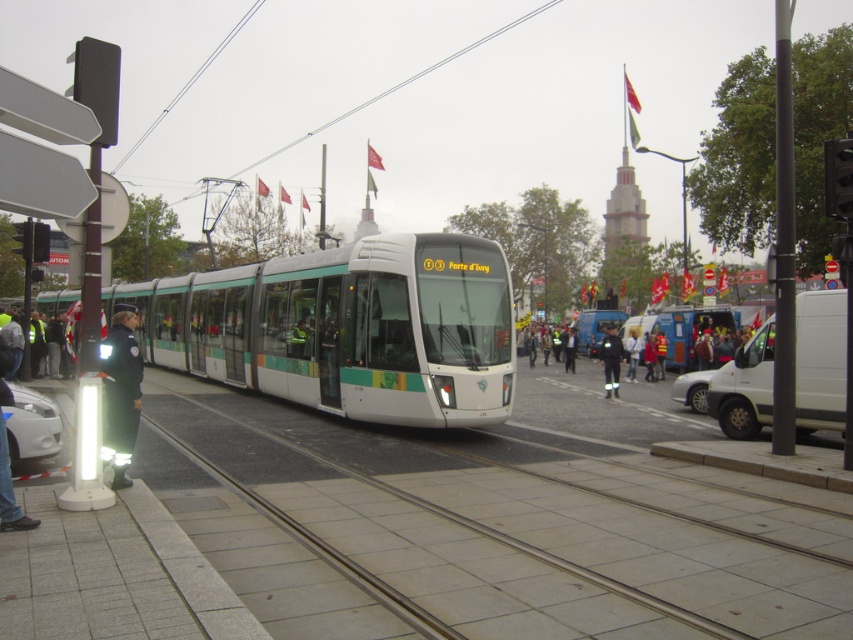
From the picture: Between metallic silver bus at center and white fabric jacket at center, which one has less height?

white fabric jacket at center

Image resolution: width=853 pixels, height=640 pixels. Find the location of `metallic silver bus at center`. metallic silver bus at center is located at coordinates [682, 330].

Is reflective green uniform at left positioned in front of metallic silver bus at center?

That is True.

Who is taller, reflective green uniform at left or metallic silver bus at center?

With more height is metallic silver bus at center.

Where is `reflective green uniform at left`? reflective green uniform at left is located at coordinates (122, 381).

You are a GUI agent. You are given a task and a screenshot of the screen. Output one action in this format:
    pyautogui.click(x=<x>, y=<y>)
    Task: Click on the reflective green uniform at left
    
    Given the screenshot: What is the action you would take?
    pyautogui.click(x=122, y=381)

Is reflective green uniform at left taller than dark blue uniform at center?

In fact, reflective green uniform at left may be shorter than dark blue uniform at center.

Which is in front, point (117, 342) or point (618, 355)?

Point (117, 342)

You are a GUI agent. You are given a task and a screenshot of the screen. Output one action in this format:
    pyautogui.click(x=<x>, y=<y>)
    Task: Click on the reflective green uniform at left
    This screenshot has width=853, height=640.
    Given the screenshot: What is the action you would take?
    pyautogui.click(x=122, y=381)